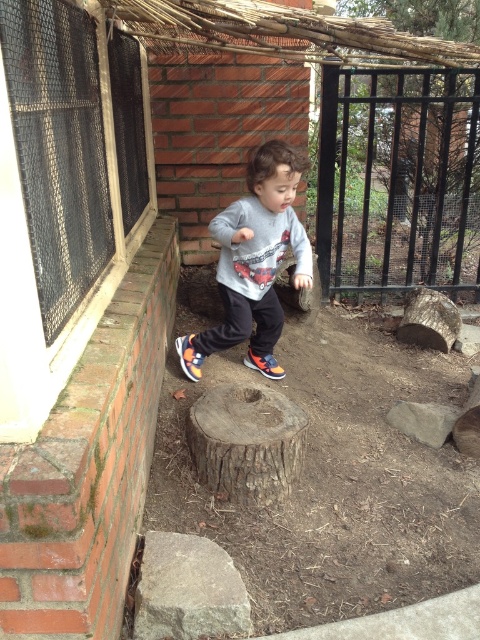
Who is shorter, black metal fence at upper right or gray rough rock at lower left?

gray rough rock at lower left

Measure the distance between black metal fence at upper right and camera.

black metal fence at upper right is 3.12 meters away from camera.

This screenshot has width=480, height=640. What are the coordinates of `black metal fence at upper right` in the screenshot? It's located at (398, 179).

Which is above, gray rough rock at lower left or gray rough rock at center?

Positioned higher is gray rough rock at center.

Does gray rough rock at lower left appear over gray rough rock at center?

Incorrect, gray rough rock at lower left is not positioned above gray rough rock at center.

Who is more distant from viewer, (213, 557) or (425, 424)?

Positioned behind is point (425, 424).

I want to click on gray rough rock at lower left, so click(188, 589).

Between metal mesh screen at left and multicolored fabric shoe at center, which one appears on the right side from the viewer's perspective?

Positioned to the right is multicolored fabric shoe at center.

Find the location of a particular element. metal mesh screen at left is located at coordinates (71, 145).

You are a GUI agent. You are given a task and a screenshot of the screen. Output one action in this format:
    pyautogui.click(x=<x>, y=<y>)
    Task: Click on the metal mesh screen at left
    The image size is (480, 640).
    Given the screenshot: What is the action you would take?
    pyautogui.click(x=71, y=145)